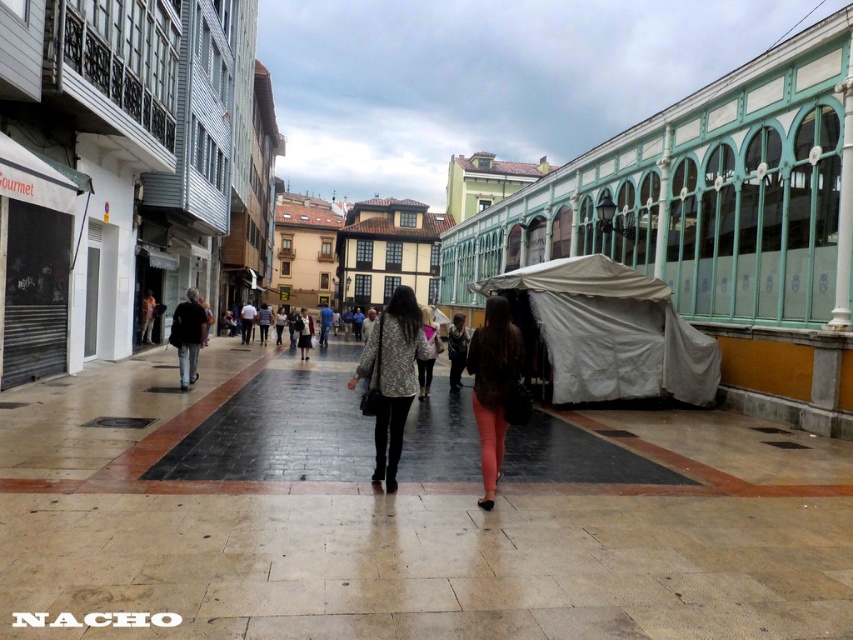
Is light brown leather jacket at center positioned before matte pink coat at center?

Yes, light brown leather jacket at center is closer to the viewer.

Which is more to the right, light brown leather jacket at center or matte pink coat at center?

From the viewer's perspective, light brown leather jacket at center appears more on the right side.

The height and width of the screenshot is (640, 853). In order to click on light brown leather jacket at center in this screenshot , I will do `click(492, 385)`.

This screenshot has width=853, height=640. I want to click on light brown leather jacket at center, so click(x=492, y=385).

Is polished stone pavement at center further to camera compared to dark gray jacket at left?

No, it is not.

Can you confirm if polished stone pavement at center is positioned to the left of dark gray jacket at left?

No, polished stone pavement at center is not to the left of dark gray jacket at left.

Is point (428, 424) positioned before point (171, 333)?

Yes, it is.

Locate an element on the screen. Image resolution: width=853 pixels, height=640 pixels. polished stone pavement at center is located at coordinates (402, 515).

Does matte pink coat at center have a lesser width compared to matte black jacket at center?

Yes.

Can you confirm if matte pink coat at center is positioned to the left of matte black jacket at center?

No, matte pink coat at center is not to the left of matte black jacket at center.

Is point (436, 324) farther from camera compared to point (302, 307)?

That is False.

Where is `matte pink coat at center`? matte pink coat at center is located at coordinates (428, 355).